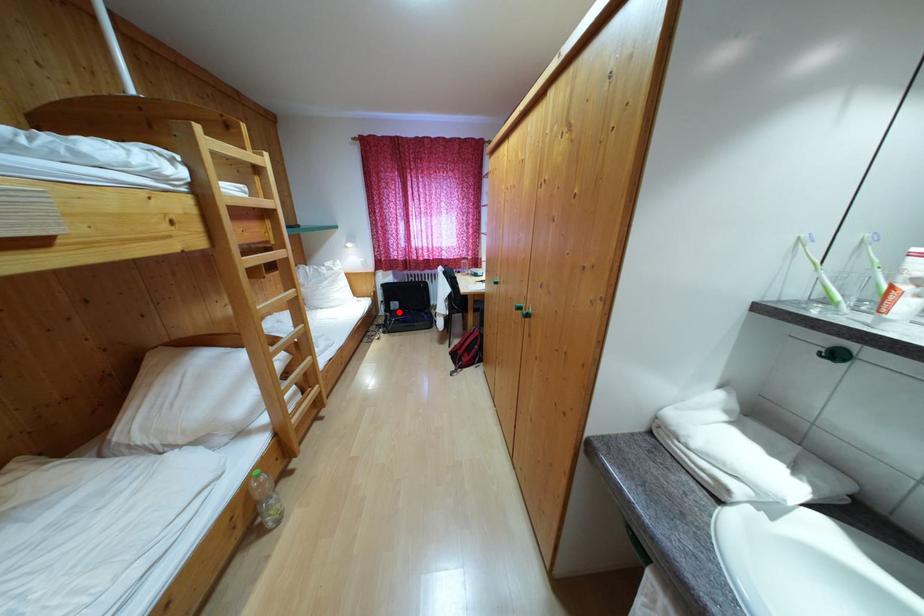
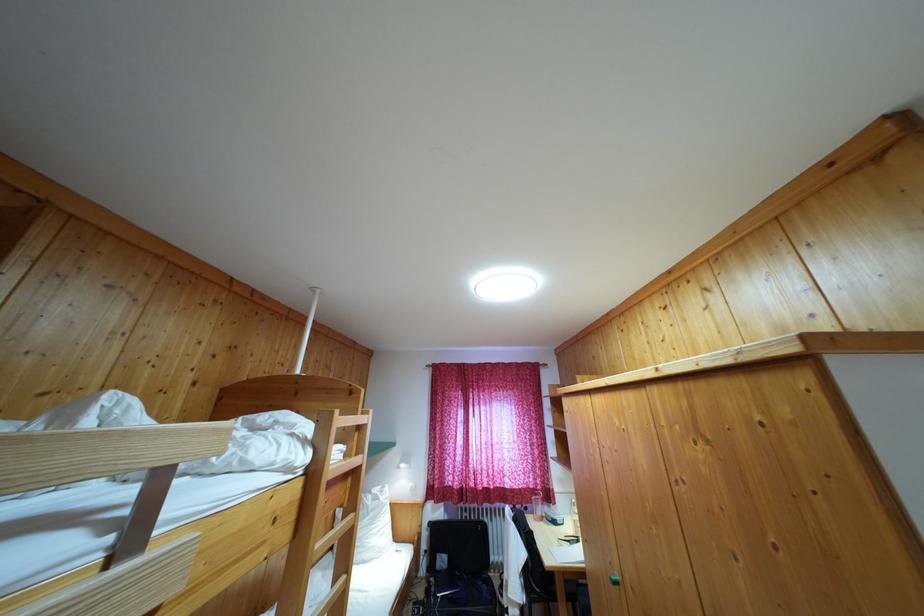
Locate, in the second image, the point that corresponds to the highlighted location in the first image.

(445, 567)